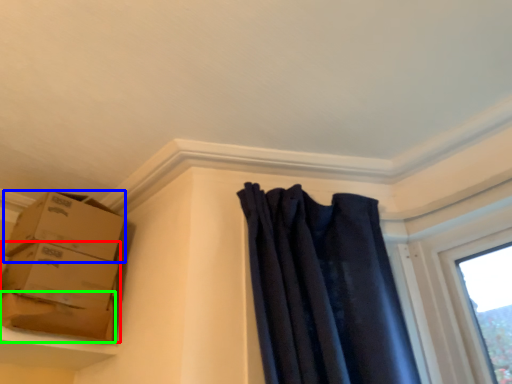
Question: Which is farther away from box (highlighted by a red box)? box (highlighted by a blue box) or cardboard box (highlighted by a green box)?

Choices:
 (A) box
 (B) cardboard box

Answer: (A)